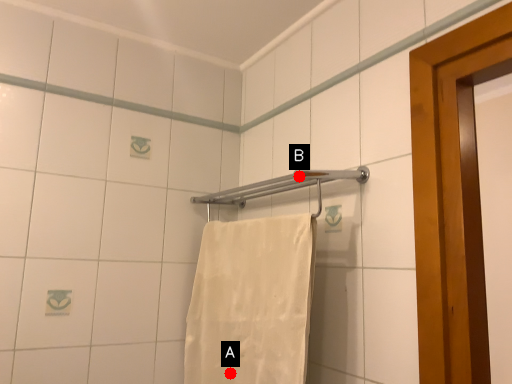
Question: Two points are circled on the image, labeled by A and B beside each circle. Which of the following is the farthest from the observer?

Choices:
 (A) A is further
 (B) B is further

Answer: (B)